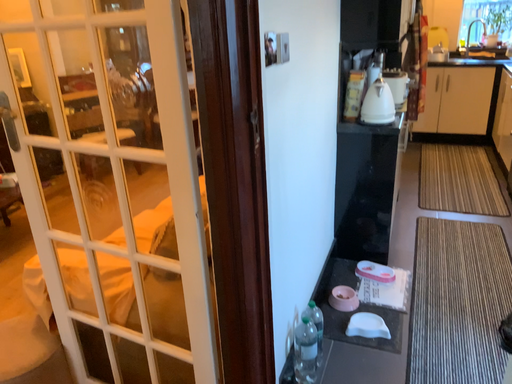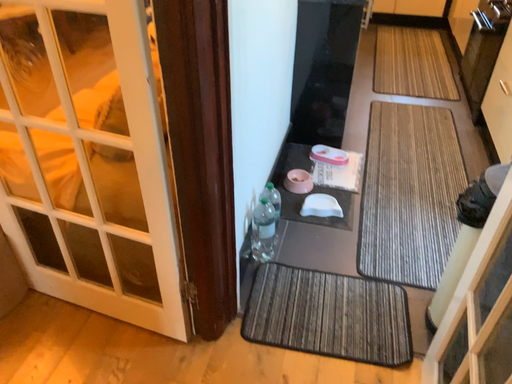
Question: How did the camera likely rotate when shooting the video?

Choices:
 (A) rotated left
 (B) rotated right

Answer: (B)